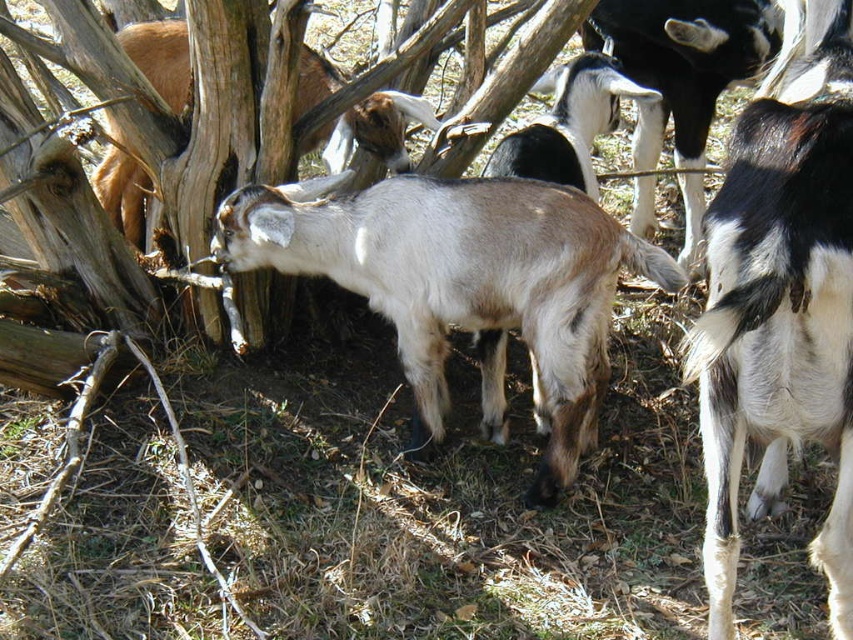
You are a farmer who wants to separate two goats based on their sizes. You have a gate that can only allow goats narrower than 1.2 meters to pass through. Given the white woolen goat at center and the black and white fur goat at center, which goat can pass through the gate?

The white woolen goat at center has a lesser width compared to the black and white fur goat at center. Therefore, the white woolen goat at center can pass through the gate since it is narrower than 1.2 meters.

You are a farmer trying to identify the larger goat in your herd. You see the light brown woolen goat at center and the black and white fur goat at center. Which goat is larger?

The light brown woolen goat at center is bigger than the black and white fur goat at center.